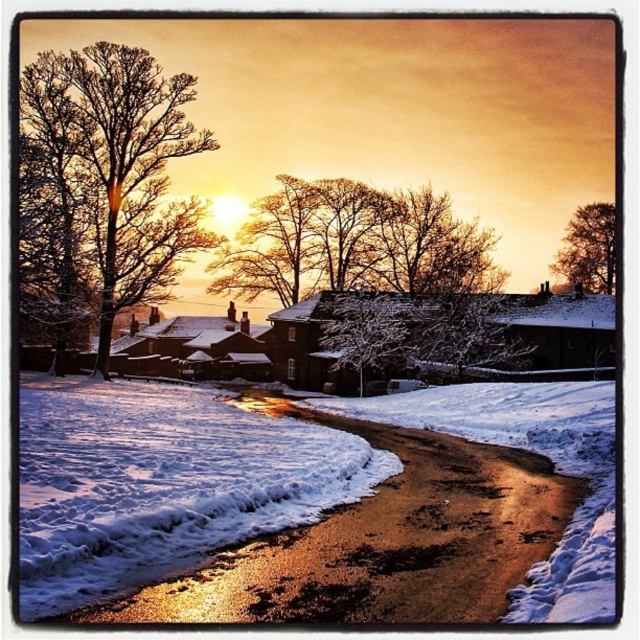
Question: Does snow-covered tree at center appear over white snow-covered tree at center?

Choices:
 (A) no
 (B) yes

Answer: (B)

Question: Considering the real-world distances, which object is closest to the snow-covered tree at center?

Choices:
 (A) shiny reflective puddle at lower center
 (B) brown textured tree at upper right
 (C) white fluffy snow at lower center

Answer: (B)

Question: Which object appears closest to the camera in this image?

Choices:
 (A) brown textured tree at upper right
 (B) shiny reflective puddle at lower center
 (C) bare branches at left

Answer: (B)

Question: Does bare branches at left have a lesser width compared to brown textured tree at upper right?

Choices:
 (A) no
 (B) yes

Answer: (B)

Question: Is snow-covered tree at center to the left of brown textured tree at upper right from the viewer's perspective?

Choices:
 (A) no
 (B) yes

Answer: (B)

Question: Estimate the real-world distances between objects in this image. Which object is farther from the white snow-covered tree at center?

Choices:
 (A) bare branches at left
 (B) brown textured tree at upper right

Answer: (B)